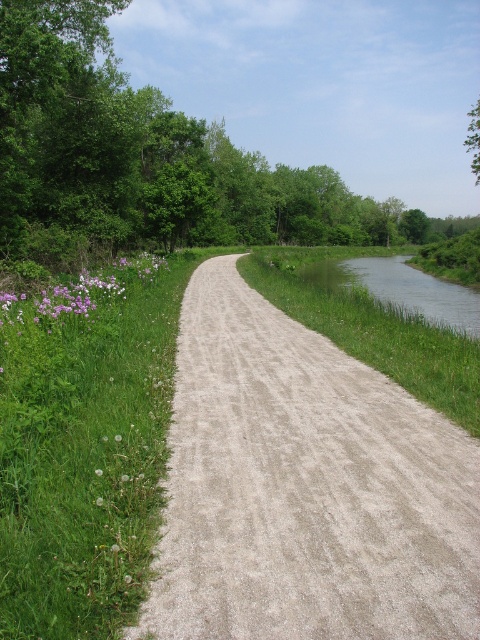
You are a gardener planning to install a 10 feet wide fence along the gray gravel path at center. Considering the green grass at left is only 11.28 feet away, will the fence encroach into the grass area?

The gray gravel path at center and green grass at left are 11.28 feet apart. Since the fence is 10 feet wide, it will not encroach into the grass area as there is sufficient space between them.